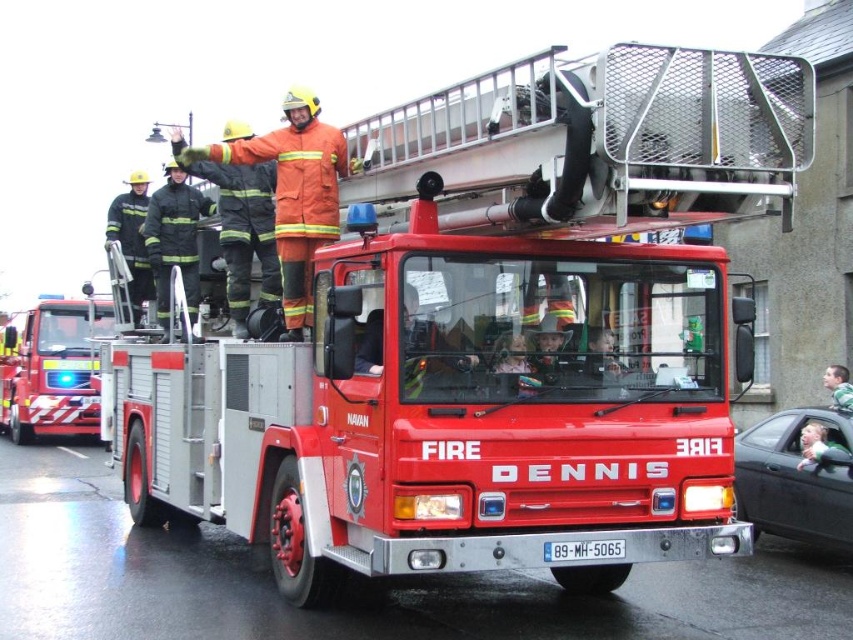
You are a photographer trying to capture a wide shot of the shiny red fire truck at left and the green fabric shirt at center. Which object is wider so that it can fill more of the frame?

The shiny red fire truck at left is wider than the green fabric shirt at center, so it will fill more of the frame.

You are a photographer at the event and want to capture both the reflective black uniform at left and the white plastic license plate at center in a single photo. Which object should you focus on first to ensure both are in frame?

You should focus on the white plastic license plate at center first because the reflective black uniform at left is smaller in size, so it will be easier to include both in the frame by centering on the larger object.

You are a photographer trying to capture the firefighter in the orange uniform at the front of the ladder. You notice a reflective black uniform at left at point (132, 240). Will this reflective black uniform at left block your view of the firefighter in the orange uniform?

The reflective black uniform at left is located at point (132, 240), which is to the left of the firefighter in the orange uniform at the front of the ladder. Since the reflective black uniform at left is positioned to the left, it would not block your view of the firefighter in the orange uniform unless you are positioned to the right side of the ladder.